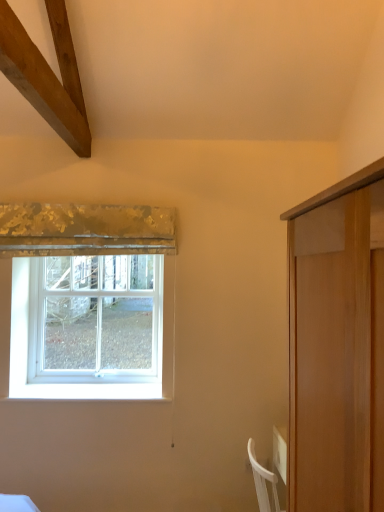
Question: From the image's perspective, is white plastic window at left positioned above or below gold textured fabric at upper left?

Choices:
 (A) below
 (B) above

Answer: (A)

Question: Considering the positions of white plastic window at left and gold textured fabric at upper left in the image, is white plastic window at left bigger or smaller than gold textured fabric at upper left?

Choices:
 (A) small
 (B) big

Answer: (B)

Question: In the image, is white plastic window at left positioned in front of or behind gold textured fabric at upper left?

Choices:
 (A) front
 (B) behind

Answer: (B)

Question: Is gold textured fabric at upper left bigger or smaller than white plastic window at left?

Choices:
 (A) small
 (B) big

Answer: (A)

Question: Is gold textured fabric at upper left in front of or behind white plastic window at left in the image?

Choices:
 (A) behind
 (B) front

Answer: (B)

Question: Considering the positions of point (61, 214) and point (54, 349), is point (61, 214) closer or farther from the camera than point (54, 349)?

Choices:
 (A) farther
 (B) closer

Answer: (B)

Question: From the image's perspective, is gold textured fabric at upper left positioned above or below white plastic window at left?

Choices:
 (A) above
 (B) below

Answer: (A)